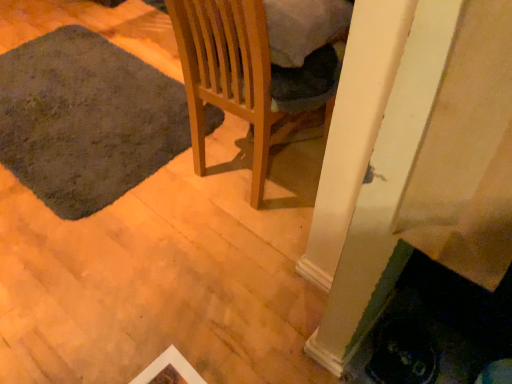
This screenshot has width=512, height=384. Find the location of `free point behind dark gray carpet at lower left`. free point behind dark gray carpet at lower left is located at coordinates (97, 24).